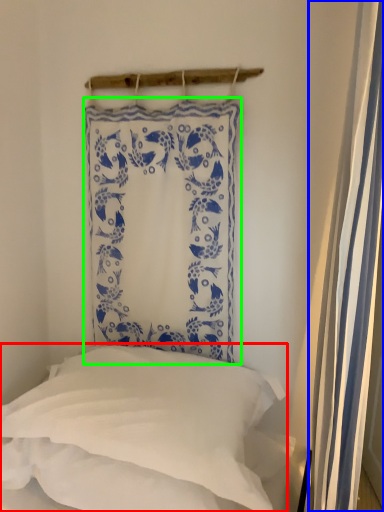
Question: Considering the real-world distances, which object is farthest from pillow (highlighted by a red box)? shower curtain (highlighted by a blue box) or curtain (highlighted by a green box)?

Choices:
 (A) shower curtain
 (B) curtain

Answer: (A)